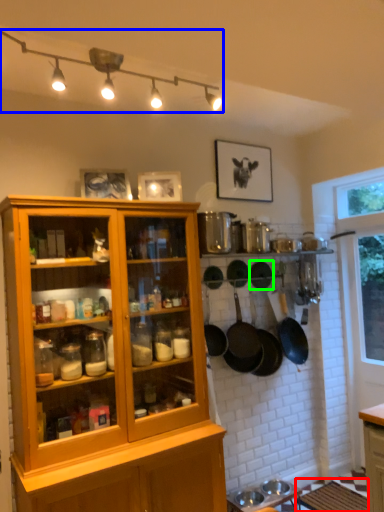
Question: Considering the real-world distances, which object is closest to table (highlighted by a red box)? light fixture (highlighted by a blue box) or frying pan (highlighted by a green box).

Choices:
 (A) light fixture
 (B) frying pan

Answer: (B)